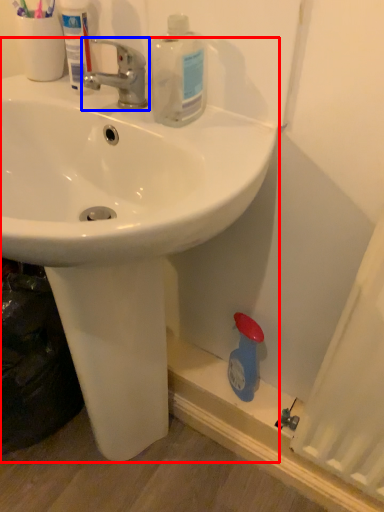
Question: Which object appears closest to the camera in this image, sink (highlighted by a red box) or tap (highlighted by a blue box)?

Choices:
 (A) sink
 (B) tap

Answer: (A)